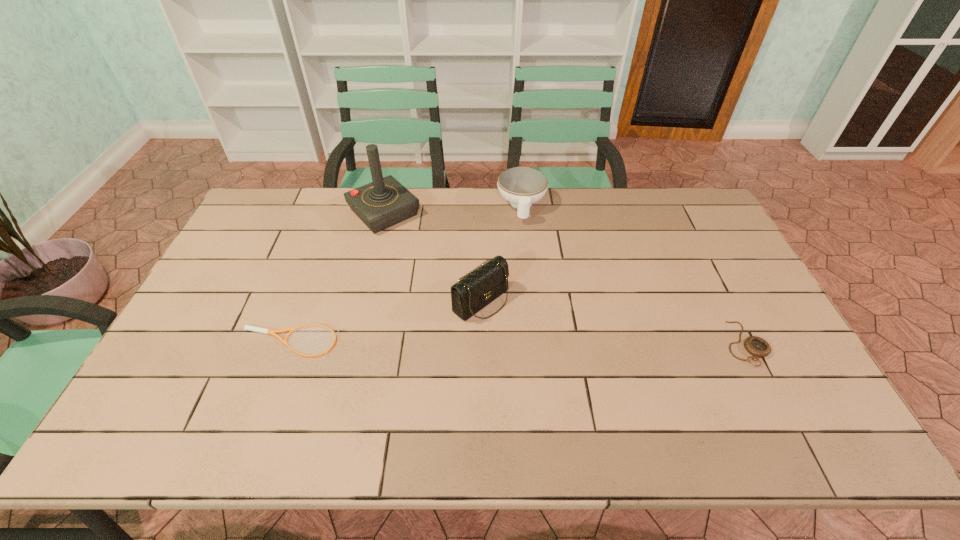
Where is `free spot on the desktop that is between the tennis racket and the fourth tallest object and is positioned on the side with the handle of the chinaware`? Image resolution: width=960 pixels, height=540 pixels. free spot on the desktop that is between the tennis racket and the fourth tallest object and is positioned on the side with the handle of the chinaware is located at coordinates (530, 343).

Where is `free space on the desktop that is between the tennis racket and the pocket watch and is positioned on the front flap of the second tallest object`? free space on the desktop that is between the tennis racket and the pocket watch and is positioned on the front flap of the second tallest object is located at coordinates (535, 343).

Image resolution: width=960 pixels, height=540 pixels. In order to click on vacant space on the desktop that is between the shortest object and the rightmost object and is positioned on the rectangular base of the joystick in this screenshot , I will do `click(517, 343)`.